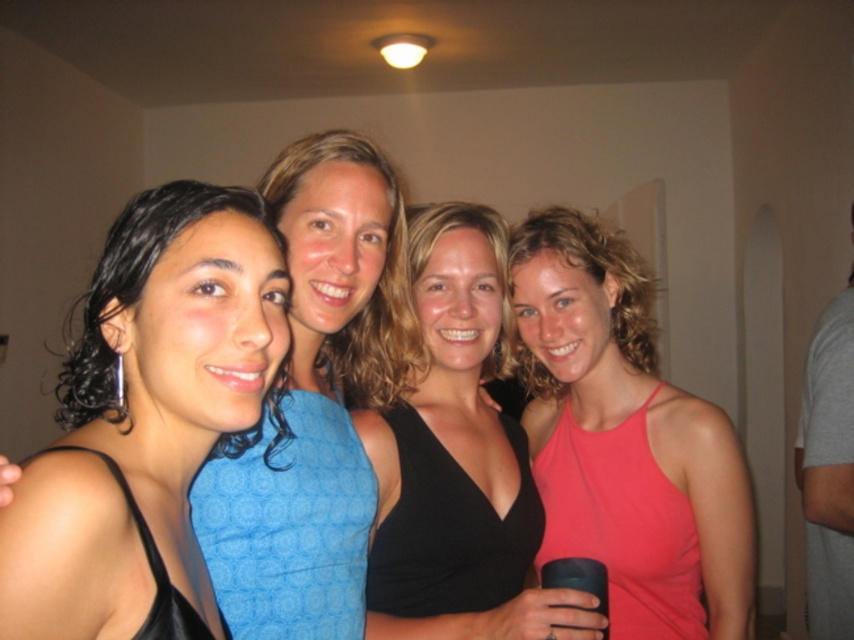
Find the location of `black matte tank top at left`. black matte tank top at left is located at coordinates (147, 413).

Between black matte tank top at left and pink matte tank top at center, which one is positioned lower?

pink matte tank top at center

Is point (156, 413) positioned after point (557, 481)?

No, it is in front of (557, 481).

Where is `black matte tank top at left`? This screenshot has width=854, height=640. black matte tank top at left is located at coordinates (147, 413).

Who is more forward, (559, 420) or (466, 216)?

Positioned in front is point (466, 216).

Is pink matte tank top at center bigger than black matte tank top at center?

Correct, pink matte tank top at center is larger in size than black matte tank top at center.

The height and width of the screenshot is (640, 854). What do you see at coordinates (624, 438) in the screenshot?
I see `pink matte tank top at center` at bounding box center [624, 438].

What are the coordinates of `pink matte tank top at center` in the screenshot? It's located at (624, 438).

Who is more forward, (629, 337) or (810, 493)?

Positioned in front is point (629, 337).

Is pink matte tank top at center smaller than gray cotton t-shirt at right?

Yes, pink matte tank top at center is smaller than gray cotton t-shirt at right.

Measure the distance between pink matte tank top at center and camera.

They are 1.21 meters apart.

In order to click on pink matte tank top at center in this screenshot , I will do `click(624, 438)`.